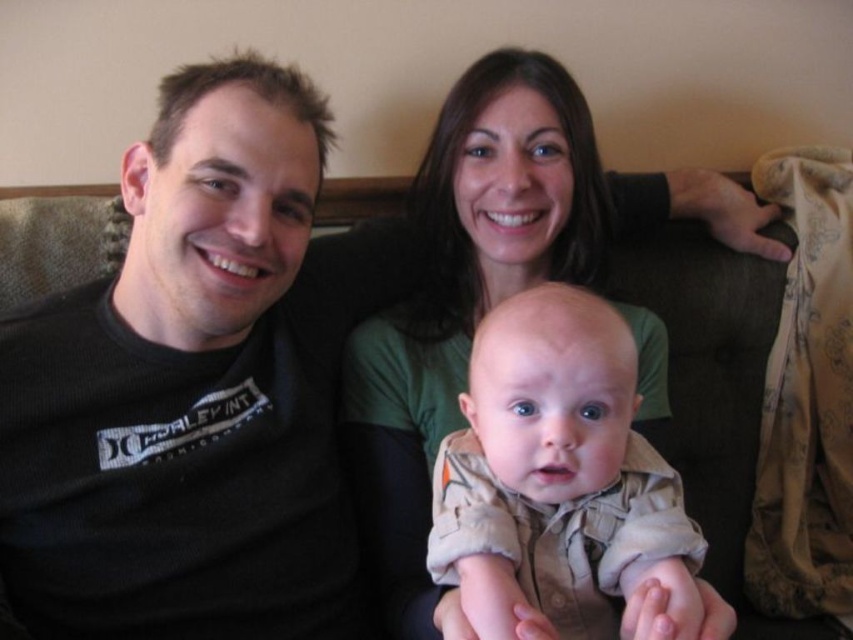
Does green matte shirt at center appear under tan cotton onesie at center?

No.

Is point (500, 298) farther from camera compared to point (572, 472)?

Yes, point (500, 298) is behind point (572, 472).

Identify the location of green matte shirt at center. Image resolution: width=853 pixels, height=640 pixels. (473, 289).

Between black cotton t-shirt at left and green matte shirt at center, which one appears on the left side from the viewer's perspective?

black cotton t-shirt at left

Does black cotton t-shirt at left have a smaller size compared to green matte shirt at center?

Correct, black cotton t-shirt at left occupies less space than green matte shirt at center.

Locate an element on the screen. black cotton t-shirt at left is located at coordinates (184, 394).

In order to click on black cotton t-shirt at left in this screenshot , I will do coord(184,394).

Does brown fabric couch at center appear on the left side of green matte shirt at center?

Indeed, brown fabric couch at center is positioned on the left side of green matte shirt at center.

Consider the image. Is brown fabric couch at center taller than green matte shirt at center?

Incorrect, brown fabric couch at center's height is not larger of green matte shirt at center's.

Which is in front, point (32, 563) or point (349, 435)?

Point (32, 563)

I want to click on brown fabric couch at center, so click(189, 464).